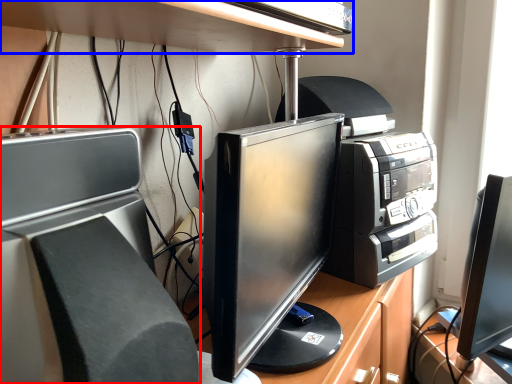
Question: Which object is further to the camera taking this photo, home appliance (highlighted by a red box) or desk (highlighted by a blue box)?

Choices:
 (A) home appliance
 (B) desk

Answer: (B)